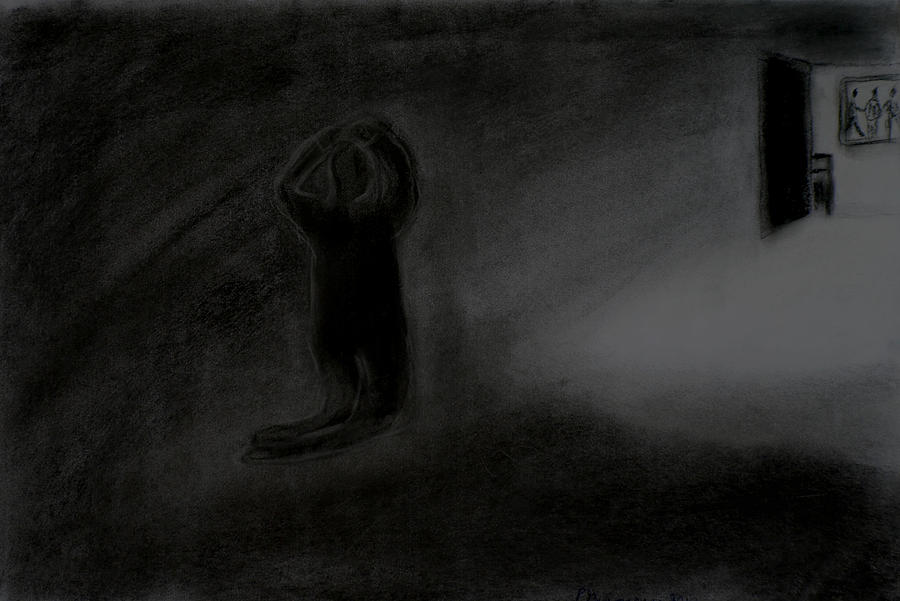
Locate an element on the screen. The height and width of the screenshot is (601, 900). illuminated hallway is located at coordinates (873, 175).